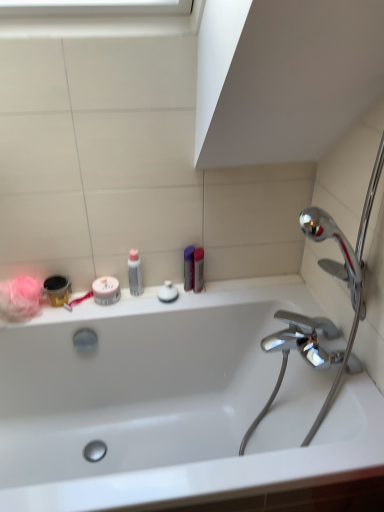
Identify the location of free location in front of metallic silver mouthwash at right, acting as the 2th mouthwash starting from the left. The height and width of the screenshot is (512, 384). (195, 304).